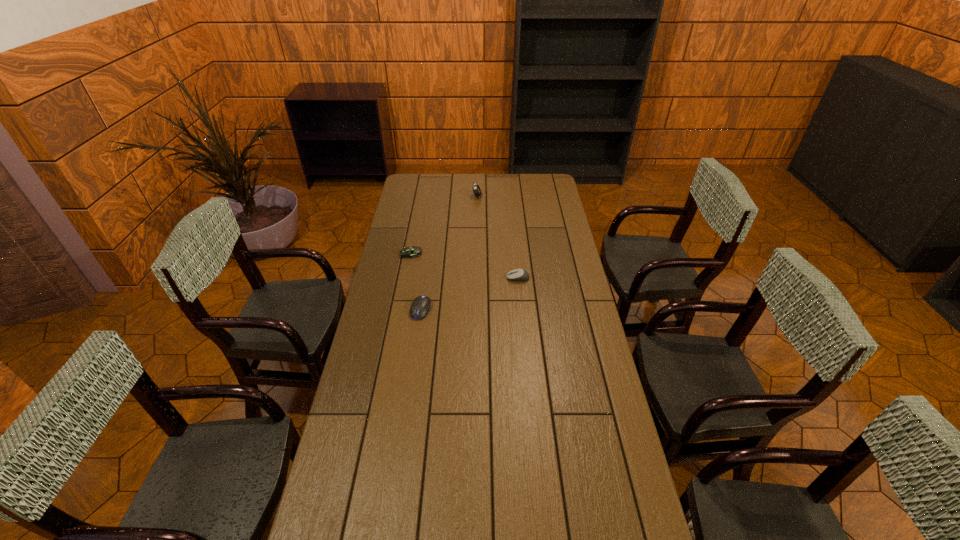
Find the location of `computer mouse that is the second nearest to the nearest object`. computer mouse that is the second nearest to the nearest object is located at coordinates (517, 274).

Identify the location of vacant space that satisfies the following two spatial constraints: 1. on the face of the tallest object; 2. on the front side of the nearest object. Image resolution: width=960 pixels, height=540 pixels. (476, 310).